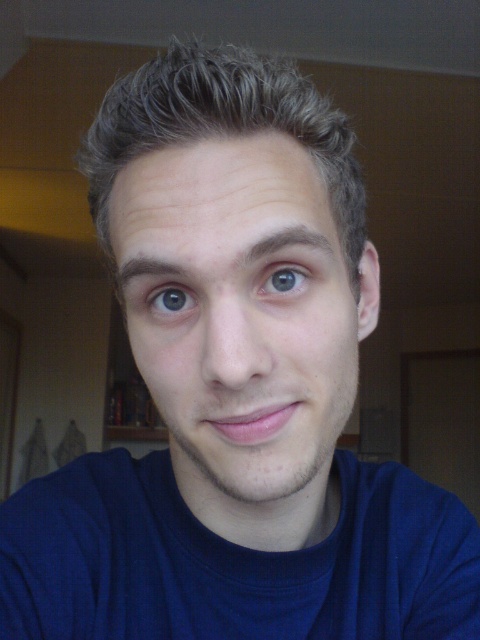
You are a photographer adjusting the lighting for a portrait. You notice the light brown textured hair at center and the blue glossy eye at center in your frame. Which object is located to the left of the other?

The light brown textured hair at center is positioned on the left side of blue glossy eye at center.

Based on the scene description, where is the light brown textured hair at center positioned in terms of coordinates?

The light brown textured hair at center is located at point (222, 128).

Based on the scene description, which object is shorter between the blue cotton shirt at center and the light brown textured hair at center?

The blue cotton shirt at center is shorter than the light brown textured hair at center.